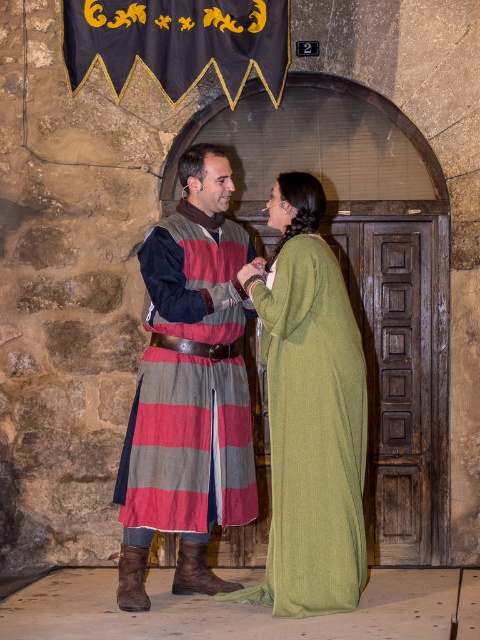
You are a tailor observing two garments in the image. The striped wool tunic at center and the green woolen dress at center. Which garment reaches a higher point on the body?

The striped wool tunic at center has a greater height compared to the green woolen dress at center, so the striped wool tunic at center reaches a higher point on the body.

In the scene shown: You are a tailor observing two garments in the image. The striped wool tunic at center and the green woolen dress at center. Which one is narrower?

The striped wool tunic at center is narrower than the green woolen dress at center.

You are a medieval knight approaching the striped wool tunic at center and the green woolen dress at center. Which one should you greet first according to the spatial arrangement?

You should greet the striped wool tunic at center first because it is closer to you than the green woolen dress at center, so it is proper to acknowledge the closer individual first.